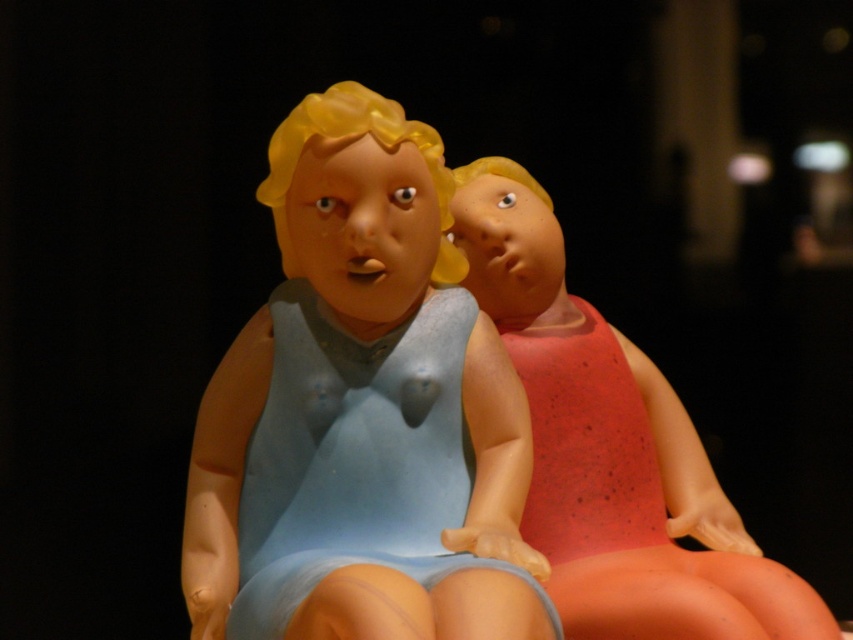
You are an art curator examining two figurines in an exhibition. You need to determine which object is positioned closer to the front of the display. Based on the scene, which one is closer to the viewer between the matte blue dress at center and the matte red swimsuit at right?

The matte blue dress at center is closer to the viewer than the matte red swimsuit at right.

You are an artist trying to draw the two figurines from the image. You want to ensure that the depth perception is accurate. Which of the two points, point (440,362) or point (694,556), should you draw closer to the viewer in your sketch?

Point (440,362) should be drawn closer to the viewer because it is closer to the camera than point (694,556).

Where is the matte blue dress at center located?

The matte blue dress at center is located at point (363, 413).